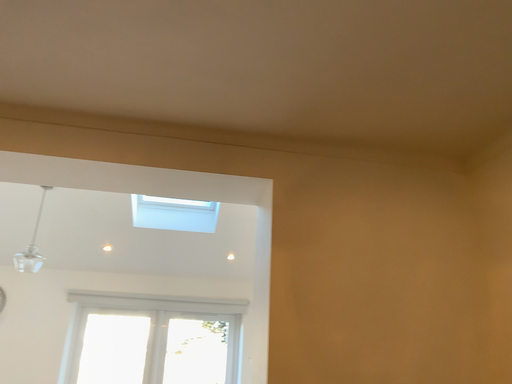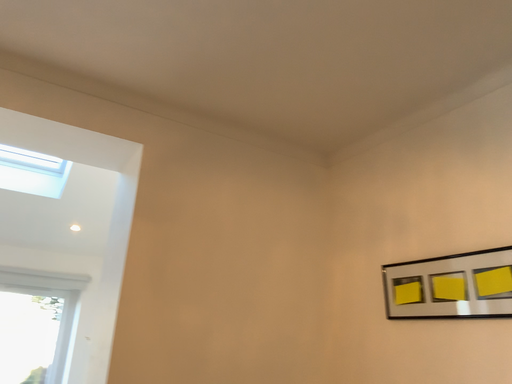
Question: How did the camera likely rotate when shooting the video?

Choices:
 (A) rotated left
 (B) rotated right

Answer: (B)